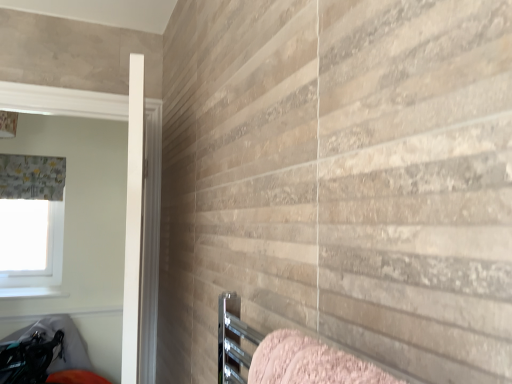
Question: From a real-world perspective, is pink textured towel at lower right physically below white glossy window sill at lower left?

Choices:
 (A) yes
 (B) no

Answer: (B)

Question: Considering the relative sizes of pink textured towel at lower right and white glossy window sill at lower left in the image provided, is pink textured towel at lower right shorter than white glossy window sill at lower left?

Choices:
 (A) yes
 (B) no

Answer: (B)

Question: Is pink textured towel at lower right far away from white glossy window sill at lower left?

Choices:
 (A) no
 (B) yes

Answer: (B)

Question: From the image's perspective, would you say pink textured towel at lower right is positioned over white glossy window sill at lower left?

Choices:
 (A) no
 (B) yes

Answer: (B)

Question: Is white glossy window sill at lower left located within pink textured towel at lower right?

Choices:
 (A) yes
 (B) no

Answer: (B)

Question: Is white glossy window sill at lower left wider or thinner than white fabric at upper left?

Choices:
 (A) thin
 (B) wide

Answer: (B)

Question: Is white glossy window sill at lower left in front of or behind white fabric at upper left in the image?

Choices:
 (A) front
 (B) behind

Answer: (A)

Question: From a real-world perspective, is white glossy window sill at lower left positioned above or below white fabric at upper left?

Choices:
 (A) below
 (B) above

Answer: (A)

Question: Based on their sizes in the image, would you say white glossy window sill at lower left is bigger or smaller than white fabric at upper left?

Choices:
 (A) big
 (B) small

Answer: (B)

Question: Would you say white fabric at upper left is to the left or to the right of textured gray curtain at left in the picture?

Choices:
 (A) right
 (B) left

Answer: (B)

Question: Considering the positions of white fabric at upper left and textured gray curtain at left in the image, is white fabric at upper left bigger or smaller than textured gray curtain at left?

Choices:
 (A) big
 (B) small

Answer: (B)

Question: Would you say white fabric at upper left is inside or outside textured gray curtain at left?

Choices:
 (A) inside
 (B) outside

Answer: (B)

Question: From the image's perspective, is white fabric at upper left located above or below textured gray curtain at left?

Choices:
 (A) below
 (B) above

Answer: (A)

Question: In terms of width, does white smooth door at left look wider or thinner when compared to textured gray curtain at left?

Choices:
 (A) wide
 (B) thin

Answer: (A)

Question: Is point (129, 327) closer or farther from the camera than point (3, 173)?

Choices:
 (A) farther
 (B) closer

Answer: (B)